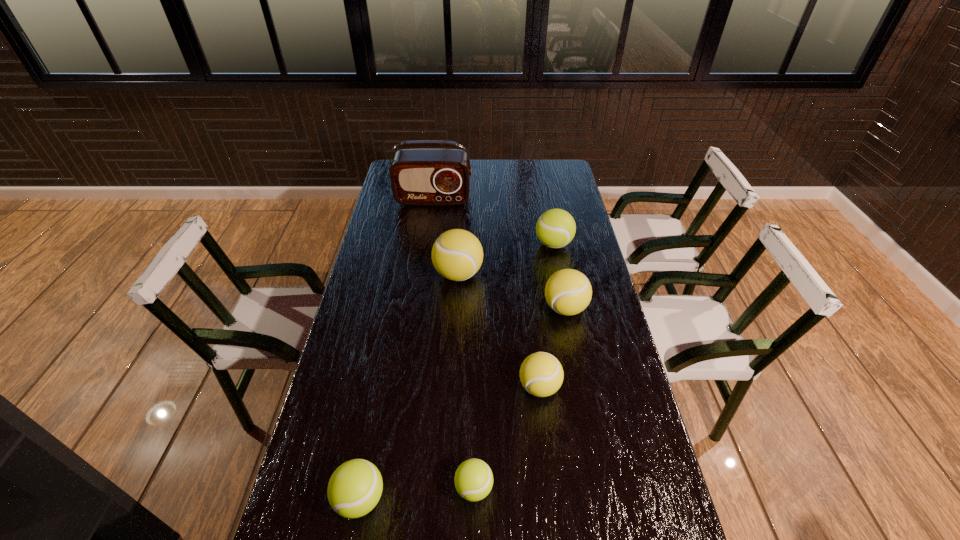
Locate an element on the screen. vacant region between the biggest yellow tennis ball and the rightmost green tennis ball is located at coordinates (506, 259).

What are the coordinates of `free space that is in between the fifth nearest tennis ball and the rightmost green tennis ball` in the screenshot? It's located at (506, 259).

Identify the location of vacant area that lies between the smallest green tennis ball and the second biggest green tennis ball. The width and height of the screenshot is (960, 540). (418, 493).

Where is `free space between the fourth nearest tennis ball and the leftmost green tennis ball`? free space between the fourth nearest tennis ball and the leftmost green tennis ball is located at coordinates (463, 403).

Find the location of a particular element. object identified as the second closest to the second green tennis ball from right to left is located at coordinates (541, 374).

This screenshot has height=540, width=960. I want to click on object that can be found as the second closest to the smallest yellow tennis ball, so click(473, 480).

You are a GUI agent. You are given a task and a screenshot of the screen. Output one action in this format:
    pyautogui.click(x=<x>, y=<y>)
    Task: Click on the fifth closest tennis ball to the second smallest green tennis ball
    The image size is (960, 540).
    Given the screenshot: What is the action you would take?
    pyautogui.click(x=555, y=228)

Point out which tennis ball is positioned as the fifth nearest to the fifth farthest object. Please provide its 2D coordinates. Your answer should be formatted as a tuple, i.e. [(x, y)], where the tuple contains the x and y coordinates of a point satisfying the conditions above.

[(555, 228)]

Locate which yellow tennis ball ranks in proximity to the leftmost tennis ball. Please provide its 2D coordinates. Your answer should be formatted as a tuple, i.e. [(x, y)], where the tuple contains the x and y coordinates of a point satisfying the conditions above.

[(541, 374)]

Identify which yellow tennis ball is the second closest to the farthest tennis ball. Please provide its 2D coordinates. Your answer should be formatted as a tuple, i.e. [(x, y)], where the tuple contains the x and y coordinates of a point satisfying the conditions above.

[(457, 254)]